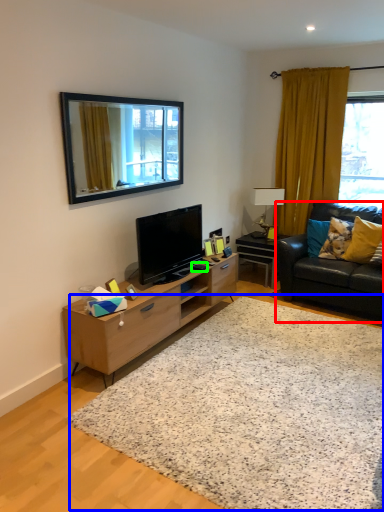
Question: Which object is positioned farthest from studio couch (highlighted by a red box)? Select from plain (highlighted by a blue box) and remote control (highlighted by a green box).

Choices:
 (A) plain
 (B) remote control

Answer: (A)